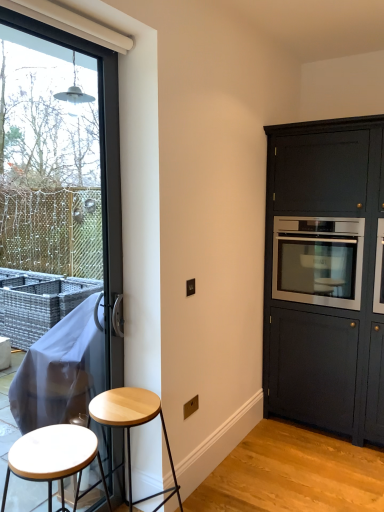
Question: Is matte dark wood cabinet at right behind light wood stool at lower left, which is counted as the 2th stool, starting from the front?

Choices:
 (A) no
 (B) yes

Answer: (B)

Question: Considering the relative sizes of matte dark wood cabinet at right and light wood stool at lower left, which is counted as the 2th stool, starting from the front, in the image provided, is matte dark wood cabinet at right taller than light wood stool at lower left, which is counted as the 2th stool, starting from the front,?

Choices:
 (A) no
 (B) yes

Answer: (B)

Question: Does matte dark wood cabinet at right have a lesser width compared to light wood stool at lower left, the first stool in the back-to-front sequence?

Choices:
 (A) yes
 (B) no

Answer: (B)

Question: Is matte dark wood cabinet at right far from light wood stool at lower left, the first stool in the back-to-front sequence?

Choices:
 (A) no
 (B) yes

Answer: (B)

Question: Does matte dark wood cabinet at right contain light wood stool at lower left, which is counted as the 2th stool, starting from the front?

Choices:
 (A) yes
 (B) no

Answer: (B)

Question: In terms of height, does stainless steel oven at right look taller or shorter compared to matte dark wood cabinet at right?

Choices:
 (A) short
 (B) tall

Answer: (A)

Question: Based on their sizes in the image, would you say stainless steel oven at right is bigger or smaller than matte dark wood cabinet at right?

Choices:
 (A) small
 (B) big

Answer: (A)

Question: Looking at their shapes, would you say stainless steel oven at right is wider or thinner than matte dark wood cabinet at right?

Choices:
 (A) thin
 (B) wide

Answer: (A)

Question: Choose the correct answer: Is stainless steel oven at right inside matte dark wood cabinet at right or outside it?

Choices:
 (A) inside
 (B) outside

Answer: (A)

Question: From a real-world perspective, is white matte stool at lower left, which appears as the first stool when viewed from the front, positioned above or below light wood stool at lower left, which is counted as the 2th stool, starting from the front?

Choices:
 (A) below
 (B) above

Answer: (B)

Question: Is white matte stool at lower left, which appears as the first stool when viewed from the front, bigger or smaller than light wood stool at lower left, the first stool in the back-to-front sequence?

Choices:
 (A) small
 (B) big

Answer: (A)

Question: Is white matte stool at lower left, arranged as the 2th stool when viewed from the back, inside the boundaries of light wood stool at lower left, which is counted as the 2th stool, starting from the front, or outside?

Choices:
 (A) inside
 (B) outside

Answer: (B)

Question: Would you say white matte stool at lower left, arranged as the 2th stool when viewed from the back, is to the left or to the right of light wood stool at lower left, which is counted as the 2th stool, starting from the front, in the picture?

Choices:
 (A) right
 (B) left

Answer: (B)

Question: Based on their sizes in the image, would you say transparent glass window at left is bigger or smaller than stainless steel oven at right?

Choices:
 (A) small
 (B) big

Answer: (A)

Question: Considering their positions, is transparent glass window at left located in front of or behind stainless steel oven at right?

Choices:
 (A) behind
 (B) front

Answer: (B)